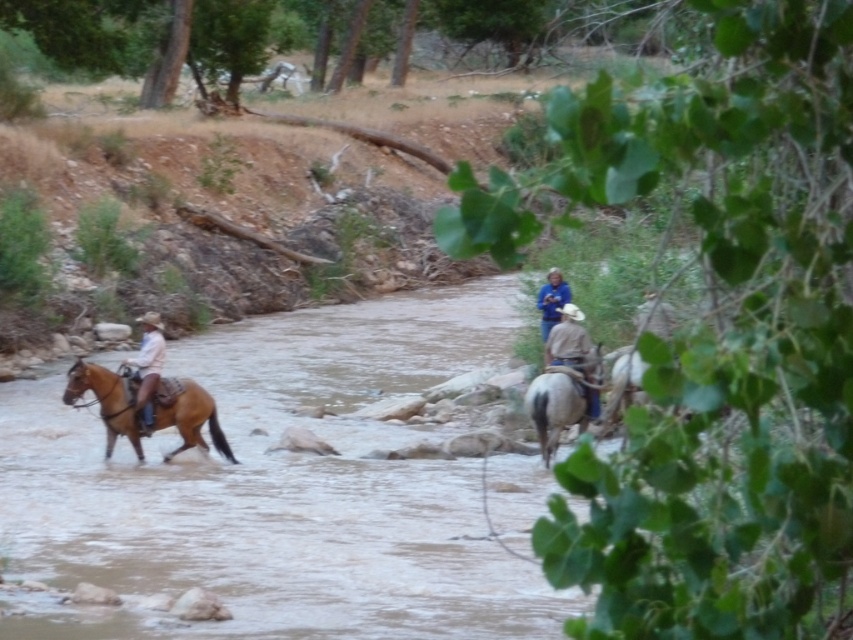
Is brown glossy horse at left taller than blue denim jacket at center?

Correct, brown glossy horse at left is much taller as blue denim jacket at center.

Between brown glossy horse at left and blue denim jacket at center, which one has more height?

Standing taller between the two is brown glossy horse at left.

Is point (105, 416) in front of point (561, 282)?

Yes, it is in front of point (561, 282).

At what (x,y) coordinates should I click in order to perform the action: click on brown glossy horse at left. Please return your answer as a coordinate pair (x, y). Looking at the image, I should click on (107, 401).

Can you confirm if blue denim shirt at center is positioned above light brown leather cowboy hat at left?

No, blue denim shirt at center is not above light brown leather cowboy hat at left.

What do you see at coordinates (563, 326) in the screenshot?
I see `blue denim shirt at center` at bounding box center [563, 326].

Where is `blue denim shirt at center`? blue denim shirt at center is located at coordinates (563, 326).

Who is lower down, light brown leather cowboy hat at left or blue denim jacket at center?

light brown leather cowboy hat at left

Does light brown leather cowboy hat at left have a smaller size compared to blue denim jacket at center?

Correct, light brown leather cowboy hat at left occupies less space than blue denim jacket at center.

What do you see at coordinates (148, 365) in the screenshot? This screenshot has height=640, width=853. I see `light brown leather cowboy hat at left` at bounding box center [148, 365].

Where is `light brown leather cowboy hat at left`? Image resolution: width=853 pixels, height=640 pixels. light brown leather cowboy hat at left is located at coordinates (148, 365).